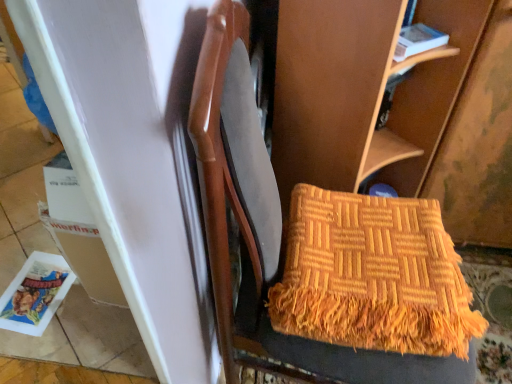
Looking at this image, what is the approximate width of white paper magazine at upper right, arranged as the first magazine when viewed from the top?

white paper magazine at upper right, arranged as the first magazine when viewed from the top, is 4.32 inches wide.

This screenshot has height=384, width=512. I want to click on matte plastic magazine at lower left, the first magazine positioned from the left, so click(35, 294).

Which of these two, orange woven blanket at center or matte plastic magazine at lower left, which appears as the first magazine when viewed from the back, is thinner?

Thinner between the two is matte plastic magazine at lower left, which appears as the first magazine when viewed from the back.

Considering the positions of objects orange woven blanket at center and matte plastic magazine at lower left, the first magazine positioned from the left, in the image provided, who is more to the left, orange woven blanket at center or matte plastic magazine at lower left, the first magazine positioned from the left,?

matte plastic magazine at lower left, the first magazine positioned from the left.

Measure the distance from white paper magazine at upper right, arranged as the first magazine when viewed from the top, to orange woven blanket at center.

white paper magazine at upper right, arranged as the first magazine when viewed from the top, is 20.11 inches from orange woven blanket at center.

Is white paper magazine at upper right, placed as the second magazine when sorted from back to front, far away from orange woven blanket at center?

No, white paper magazine at upper right, placed as the second magazine when sorted from back to front, is not far away from orange woven blanket at center.

From the image's perspective, between white paper magazine at upper right, placed as the second magazine when sorted from back to front, and orange woven blanket at center, who is located below?

orange woven blanket at center.

From a real-world perspective, is matte plastic magazine at lower left, the first magazine positioned from the left, beneath white paper magazine at upper right, which appears as the 2th magazine when viewed from the left?

Yes, from a real-world perspective, matte plastic magazine at lower left, the first magazine positioned from the left, is below white paper magazine at upper right, which appears as the 2th magazine when viewed from the left.

Can you confirm if matte plastic magazine at lower left, the first magazine positioned from the left, is thinner than white paper magazine at upper right, which ranks as the first magazine in right-to-left order?

In fact, matte plastic magazine at lower left, the first magazine positioned from the left, might be wider than white paper magazine at upper right, which ranks as the first magazine in right-to-left order.

Would you say matte plastic magazine at lower left, the first magazine positioned from the left, contains white paper magazine at upper right, which ranks as the first magazine in right-to-left order?

No.

From the image's perspective, which one is positioned lower, matte plastic magazine at lower left, which appears as the first magazine when viewed from the back, or white paper magazine at upper right, placed as the 2th magazine when sorted from bottom to top?

matte plastic magazine at lower left, which appears as the first magazine when viewed from the back.

Can you tell me how much white paper magazine at upper right, which appears as the 2th magazine when viewed from the left, and matte plastic magazine at lower left, the 2th magazine from the right, differ in facing direction?

white paper magazine at upper right, which appears as the 2th magazine when viewed from the left, and matte plastic magazine at lower left, the 2th magazine from the right, are facing 132 degrees away from each other.

Choose the correct answer: Is white paper magazine at upper right, which appears as the 2th magazine when viewed from the left, inside matte plastic magazine at lower left, which is the 1th magazine in bottom-to-top order, or outside it?

white paper magazine at upper right, which appears as the 2th magazine when viewed from the left, cannot be found inside matte plastic magazine at lower left, which is the 1th magazine in bottom-to-top order.

Is white paper magazine at upper right, arranged as the first magazine when viewed from the top, next to matte plastic magazine at lower left, the 2th magazine in the front-to-back sequence?

No, white paper magazine at upper right, arranged as the first magazine when viewed from the top, is not next to matte plastic magazine at lower left, the 2th magazine in the front-to-back sequence.

From their relative heights in the image, would you say white paper magazine at upper right, placed as the second magazine when sorted from back to front, is taller or shorter than matte plastic magazine at lower left, the first magazine positioned from the left?

In the image, white paper magazine at upper right, placed as the second magazine when sorted from back to front, appears to be taller than matte plastic magazine at lower left, the first magazine positioned from the left.

From the image's perspective, which is below, orange woven blanket at center or white paper magazine at upper right, placed as the second magazine when sorted from back to front?

orange woven blanket at center appears lower in the image.

Based on the photo, is orange woven blanket at center next to white paper magazine at upper right, the 1th magazine viewed from the front?

There is a gap between orange woven blanket at center and white paper magazine at upper right, the 1th magazine viewed from the front.

How different are the orientations of orange woven blanket at center and white paper magazine at upper right, which ranks as the first magazine in right-to-left order, in degrees?

They differ by 49.7 degrees in their facing directions.

Considering the points (424, 265) and (421, 38), which point is behind, point (424, 265) or point (421, 38)?

The point (421, 38) is behind.

Based on their sizes in the image, would you say matte plastic magazine at lower left, the first magazine positioned from the left, is bigger or smaller than orange woven blanket at center?

Clearly, matte plastic magazine at lower left, the first magazine positioned from the left, is smaller in size than orange woven blanket at center.

Is matte plastic magazine at lower left, which is counted as the second magazine, starting from the top, oriented away from orange woven blanket at center?

matte plastic magazine at lower left, which is counted as the second magazine, starting from the top, does not have its back to orange woven blanket at center.

Does matte plastic magazine at lower left, the 2th magazine from the right, come in front of orange woven blanket at center?

No, matte plastic magazine at lower left, the 2th magazine from the right, is behind orange woven blanket at center.

From a real-world perspective, who is located higher, matte plastic magazine at lower left, which is the 1th magazine in bottom-to-top order, or orange woven blanket at center?

From a 3D spatial view, orange woven blanket at center is above.

Identify the location of blanket above the matte plastic magazine at lower left, which is the 1th magazine in bottom-to-top order (from a real-world perspective). (373, 276).

Where is `magazine that appears above the orange woven blanket at center (from the image's perspective)`? The image size is (512, 384). magazine that appears above the orange woven blanket at center (from the image's perspective) is located at coordinates (418, 41).

Looking at the image, which one is located further to orange woven blanket at center, matte plastic magazine at lower left, which appears as the first magazine when viewed from the back, or white paper magazine at upper right, which appears as the 2th magazine when viewed from the left?

matte plastic magazine at lower left, which appears as the first magazine when viewed from the back.

Considering their positions, is orange woven blanket at center positioned further to white paper magazine at upper right, the 1th magazine viewed from the front, than matte plastic magazine at lower left, which is counted as the second magazine, starting from the top?

Among the two, matte plastic magazine at lower left, which is counted as the second magazine, starting from the top, is located further to white paper magazine at upper right, the 1th magazine viewed from the front.

When comparing their distances from white paper magazine at upper right, placed as the 2th magazine when sorted from bottom to top, does matte plastic magazine at lower left, the 2th magazine from the right, or orange woven blanket at center seem further?

Among the two, matte plastic magazine at lower left, the 2th magazine from the right, is located further to white paper magazine at upper right, placed as the 2th magazine when sorted from bottom to top.

Which object lies nearer to the anchor point matte plastic magazine at lower left, which is counted as the second magazine, starting from the top, orange woven blanket at center or white paper magazine at upper right, placed as the second magazine when sorted from back to front?

Based on the image, orange woven blanket at center appears to be nearer to matte plastic magazine at lower left, which is counted as the second magazine, starting from the top.

Which object lies further to the anchor point matte plastic magazine at lower left, which is the 1th magazine in bottom-to-top order, white paper magazine at upper right, which appears as the 2th magazine when viewed from the left, or orange woven blanket at center?

white paper magazine at upper right, which appears as the 2th magazine when viewed from the left.

Estimate the real-world distances between objects in this image. Which object is closer to orange woven blanket at center, white paper magazine at upper right, placed as the 2th magazine when sorted from bottom to top, or matte plastic magazine at lower left, which appears as the first magazine when viewed from the back?

The object closer to orange woven blanket at center is white paper magazine at upper right, placed as the 2th magazine when sorted from bottom to top.

Locate an element on the screen. blanket located between matte plastic magazine at lower left, the 2th magazine from the right, and white paper magazine at upper right, placed as the second magazine when sorted from back to front, in the left-right direction is located at coordinates (373, 276).